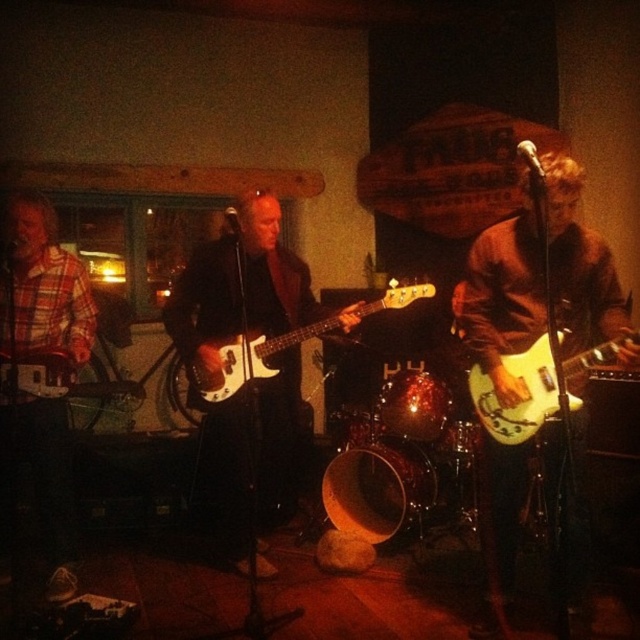
Which is above, matte black guitar at center or white glossy electric guitar at right?

white glossy electric guitar at right is higher up.

Measure the distance between matte black guitar at center and camera.

matte black guitar at center and camera are 2.95 meters apart.

At what (x,y) coordinates should I click in order to perform the action: click on matte black guitar at center. Please return your answer as a coordinate pair (x, y). Image resolution: width=640 pixels, height=640 pixels. Looking at the image, I should click on (272, 269).

Which is in front, point (483, 476) or point (538, 348)?

Point (538, 348) is in front.

Who is lower down, matte white guitar at center or white glossy electric guitar at right?

matte white guitar at center

Image resolution: width=640 pixels, height=640 pixels. Find the location of `matte white guitar at center`. matte white guitar at center is located at coordinates (502, 298).

Is matte white guitar at center to the left of white glossy electric guitar at center from the viewer's perspective?

No, matte white guitar at center is not to the left of white glossy electric guitar at center.

This screenshot has height=640, width=640. What do you see at coordinates (502, 298) in the screenshot?
I see `matte white guitar at center` at bounding box center [502, 298].

Find the location of `matte white guitar at center`. matte white guitar at center is located at coordinates (502, 298).